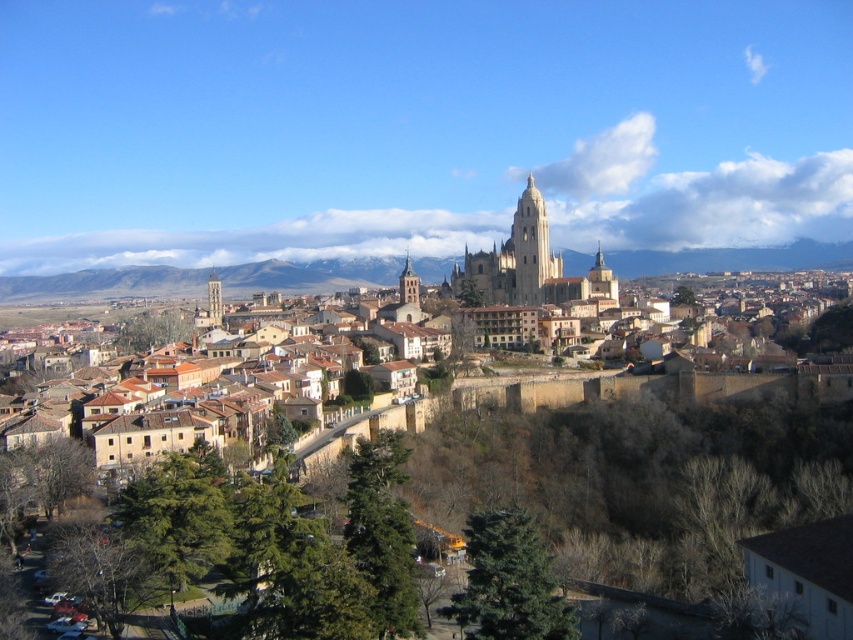
This screenshot has width=853, height=640. What do you see at coordinates (734, 259) in the screenshot?
I see `brown stone town at center` at bounding box center [734, 259].

Does point (596, 256) lie behind point (511, 280)?

Yes, point (596, 256) is farther from viewer.

Locate an element on the screen. Image resolution: width=853 pixels, height=640 pixels. brown stone town at center is located at coordinates (734, 259).